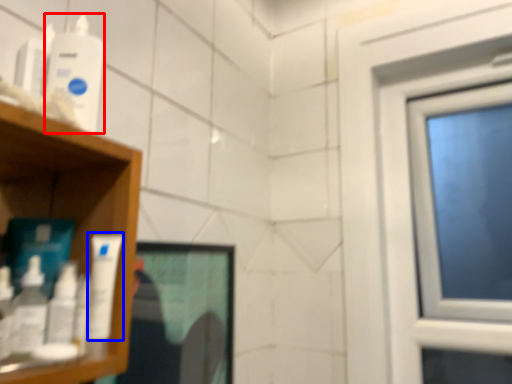
Question: Among these objects, which one is farthest to the camera, mouthwash (highlighted by a red box) or mouthwash (highlighted by a blue box)?

Choices:
 (A) mouthwash
 (B) mouthwash

Answer: (A)